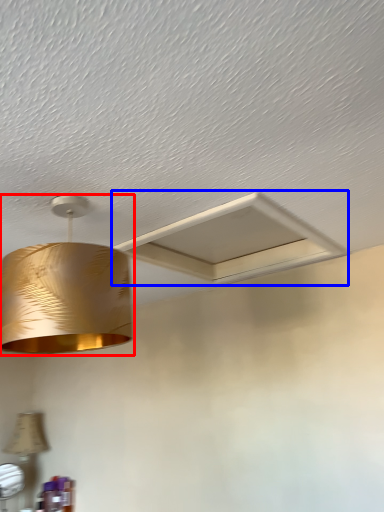
Question: Which object appears farthest to the camera in this image, lamp (highlighted by a red box) or exhaust hood (highlighted by a blue box)?

Choices:
 (A) lamp
 (B) exhaust hood

Answer: (B)